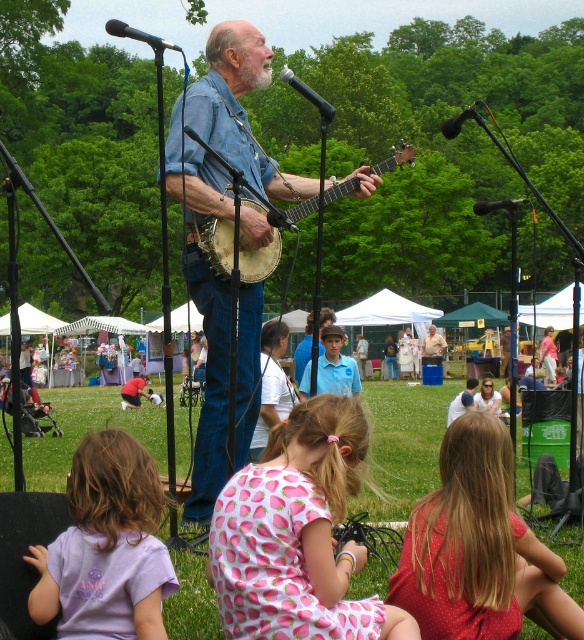
Question: Among these points, which one is nearest to the camera?

Choices:
 (A) (453, 481)
 (B) (491, 396)
 (C) (312, 186)
 (D) (353, 401)

Answer: (D)

Question: Which object is the farthest from the blue shirt at center?

Choices:
 (A) denim shirt at center
 (B) smooth brown hair at lower right

Answer: (B)

Question: Does light brown wooden banjo at center have a greater width compared to smooth brown hair at lower right?

Choices:
 (A) yes
 (B) no

Answer: (A)

Question: Can you confirm if denim shirt at center is thinner than smooth brown hair at lower right?

Choices:
 (A) no
 (B) yes

Answer: (A)

Question: Which object is closer to the camera taking this photo?

Choices:
 (A) blue shirt at center
 (B) smooth brown hair at lower right

Answer: (A)

Question: Where is denim shirt at center located in relation to polka dot fabric dress at lower right in the image?

Choices:
 (A) left
 (B) right

Answer: (A)